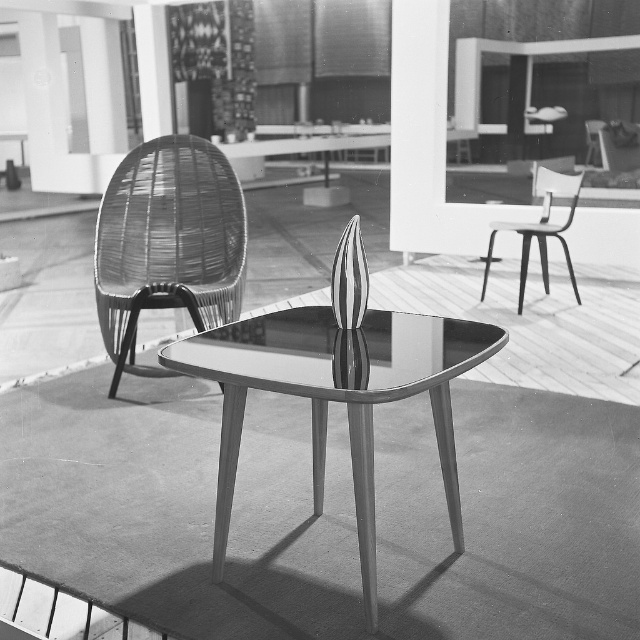
Question: Can you confirm if metallic glass table at center is smaller than metallic silver chair at right?

Choices:
 (A) no
 (B) yes

Answer: (A)

Question: Can you confirm if woven rattan chair at left is positioned below metallic silver chair at right?

Choices:
 (A) no
 (B) yes

Answer: (B)

Question: Which point is farther to the camera?

Choices:
 (A) (138, 173)
 (B) (577, 180)
 (C) (362, 515)

Answer: (B)

Question: Which object is farther from the camera taking this photo?

Choices:
 (A) metallic silver chair at right
 (B) woven rattan chair at left

Answer: (A)

Question: Can you confirm if woven rattan chair at left is positioned to the right of metallic silver chair at right?

Choices:
 (A) yes
 (B) no

Answer: (B)

Question: Which object is farther from the camera taking this photo?

Choices:
 (A) metallic glass table at center
 (B) metallic silver chair at right

Answer: (B)